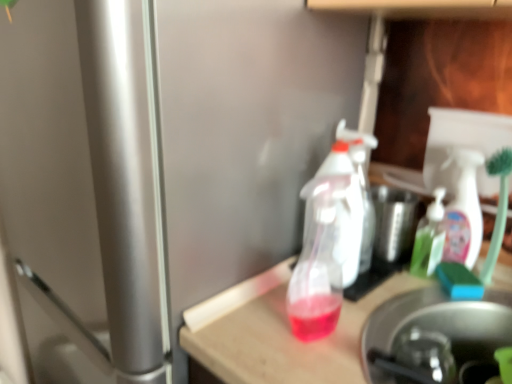
Question: Is green translucent soap dispenser at center, positioned as the second bottle in front-to-back order, at the left side of translucent plastic spray bottle at center, the 2th bottle positioned from the back?

Choices:
 (A) yes
 (B) no

Answer: (B)

Question: Is green translucent soap dispenser at center, marked as the first bottle in a back-to-front arrangement, turned away from translucent plastic spray bottle at center, the 1th bottle when ordered from left to right?

Choices:
 (A) no
 (B) yes

Answer: (A)

Question: Is green translucent soap dispenser at center, marked as the first bottle in a back-to-front arrangement, far away from translucent plastic spray bottle at center, the 2th bottle positioned from the back?

Choices:
 (A) yes
 (B) no

Answer: (B)

Question: From a real-world perspective, is green translucent soap dispenser at center, positioned as the second bottle in front-to-back order, located beneath translucent plastic spray bottle at center, which appears as the 2th bottle when viewed from the right?

Choices:
 (A) yes
 (B) no

Answer: (A)

Question: Is green translucent soap dispenser at center, which is counted as the 2th bottle, starting from the left, thinner than translucent plastic spray bottle at center, the 1th bottle when ordered from left to right?

Choices:
 (A) yes
 (B) no

Answer: (A)

Question: In the image, is green translucent soap dispenser at center, which is counted as the 2th bottle, starting from the left, positioned in front of or behind translucent plastic table at center?

Choices:
 (A) behind
 (B) front

Answer: (A)

Question: Considering the positions of green translucent soap dispenser at center, positioned as the second bottle in front-to-back order, and translucent plastic table at center in the image, is green translucent soap dispenser at center, positioned as the second bottle in front-to-back order, bigger or smaller than translucent plastic table at center?

Choices:
 (A) big
 (B) small

Answer: (B)

Question: In the image, is green translucent soap dispenser at center, which is counted as the 2th bottle, starting from the left, on the left side or the right side of translucent plastic table at center?

Choices:
 (A) left
 (B) right

Answer: (B)

Question: Looking at their shapes, would you say green translucent soap dispenser at center, the first bottle positioned from the right, is wider or thinner than translucent plastic table at center?

Choices:
 (A) thin
 (B) wide

Answer: (A)

Question: Visually, is green translucent soap dispenser at center, marked as the first bottle in a back-to-front arrangement, positioned to the left or to the right of stainless steel sink at lower right?

Choices:
 (A) right
 (B) left

Answer: (A)

Question: In the image, is green translucent soap dispenser at center, which is counted as the 2th bottle, starting from the left, positioned in front of or behind stainless steel sink at lower right?

Choices:
 (A) front
 (B) behind

Answer: (B)

Question: Does point (437, 198) appear closer or farther from the camera than point (380, 375)?

Choices:
 (A) farther
 (B) closer

Answer: (A)

Question: From a real-world perspective, is green translucent soap dispenser at center, marked as the first bottle in a back-to-front arrangement, physically located above or below stainless steel sink at lower right?

Choices:
 (A) above
 (B) below

Answer: (A)

Question: Considering the positions of translucent plastic spray bottle at center, positioned as the first bottle in front-to-back order, and stainless steel sink at lower right in the image, is translucent plastic spray bottle at center, positioned as the first bottle in front-to-back order, bigger or smaller than stainless steel sink at lower right?

Choices:
 (A) small
 (B) big

Answer: (A)

Question: Looking at their shapes, would you say translucent plastic spray bottle at center, which appears as the 2th bottle when viewed from the right, is wider or thinner than stainless steel sink at lower right?

Choices:
 (A) thin
 (B) wide

Answer: (A)